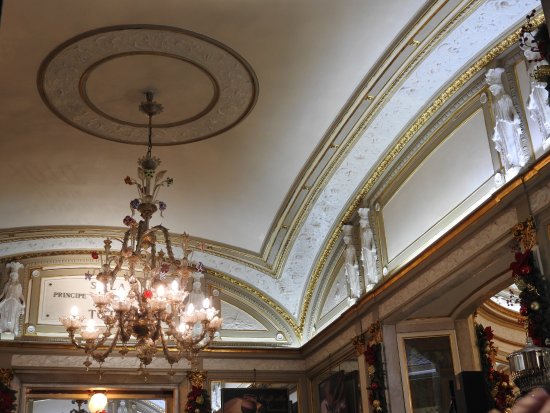
You are a GUI agent. You are given a task and a screenshot of the screen. Output one action in this format:
    pyautogui.click(x=<x>, y=<y>)
    Task: Click on the statue
    
    Given the screenshot: What is the action you would take?
    pyautogui.click(x=13, y=312), pyautogui.click(x=196, y=292), pyautogui.click(x=351, y=265), pyautogui.click(x=368, y=255), pyautogui.click(x=505, y=143), pyautogui.click(x=541, y=111)